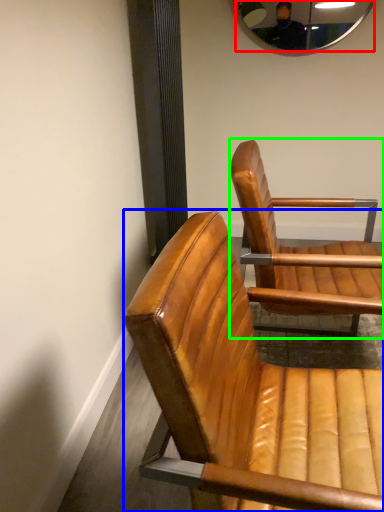
Question: Estimate the real-world distances between objects in this image. Which object is farther from mirror (highlighted by a red box), chair (highlighted by a blue box) or chair (highlighted by a green box)?

Choices:
 (A) chair
 (B) chair

Answer: (A)